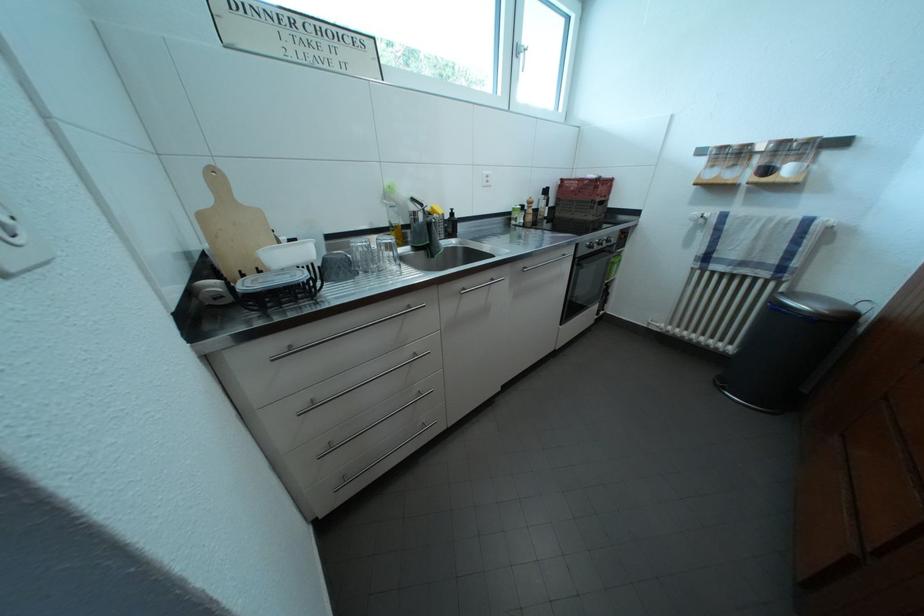
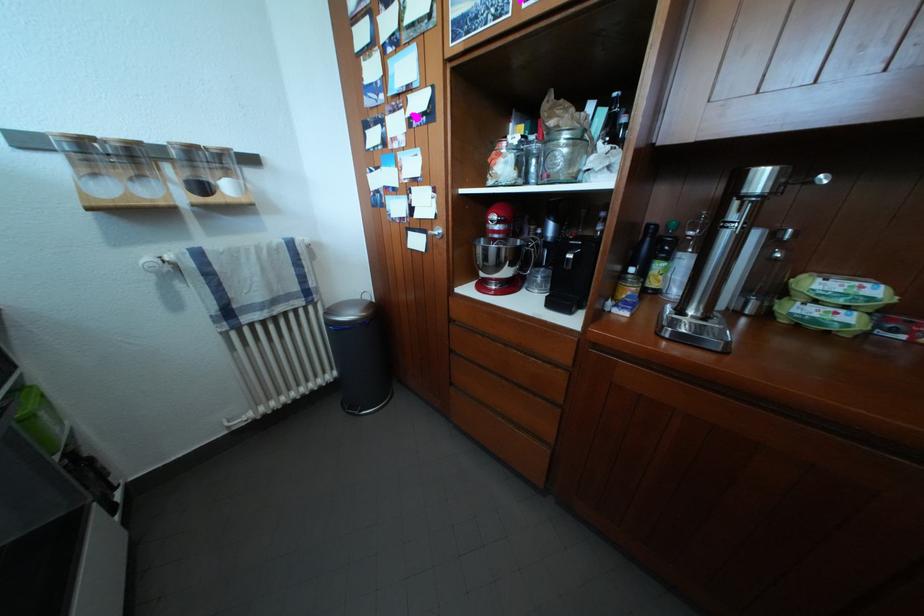
How did the camera likely rotate?

The rotation direction of the camera is right-down.